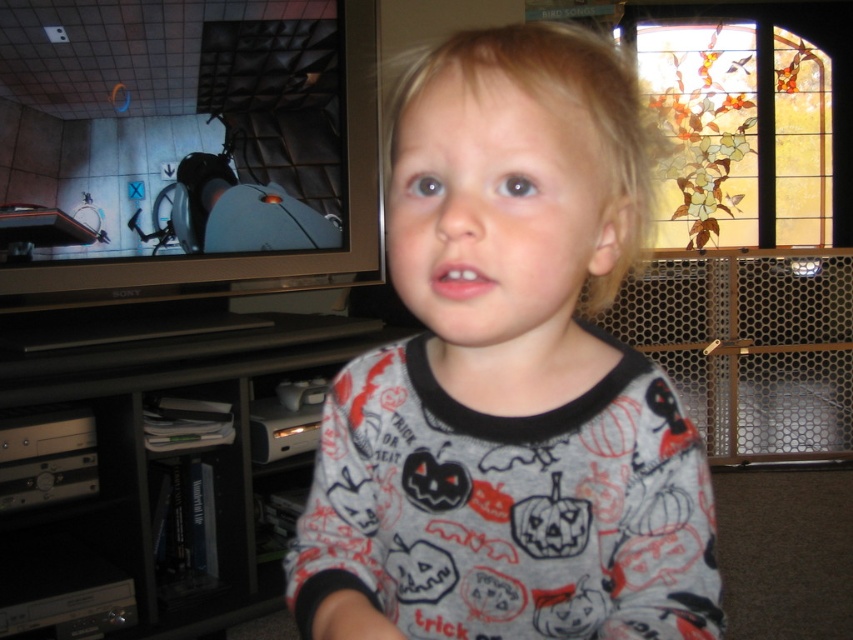
Based on the photo, what is the relationship between the thickness of the gray cotton pajamas at center and the black plastic entertainment center at lower left?

The gray cotton pajamas at center are thinner than the black plastic entertainment center at lower left.

You are a parent trying to find your child who is wearing gray cotton pajamas at center. You see the black plastic entertainment center at lower left. Which side of the entertainment center should you look to find the child?

The gray cotton pajamas at center is positioned on the right side of the black plastic entertainment center at lower left, so the child is to the right of the entertainment center.